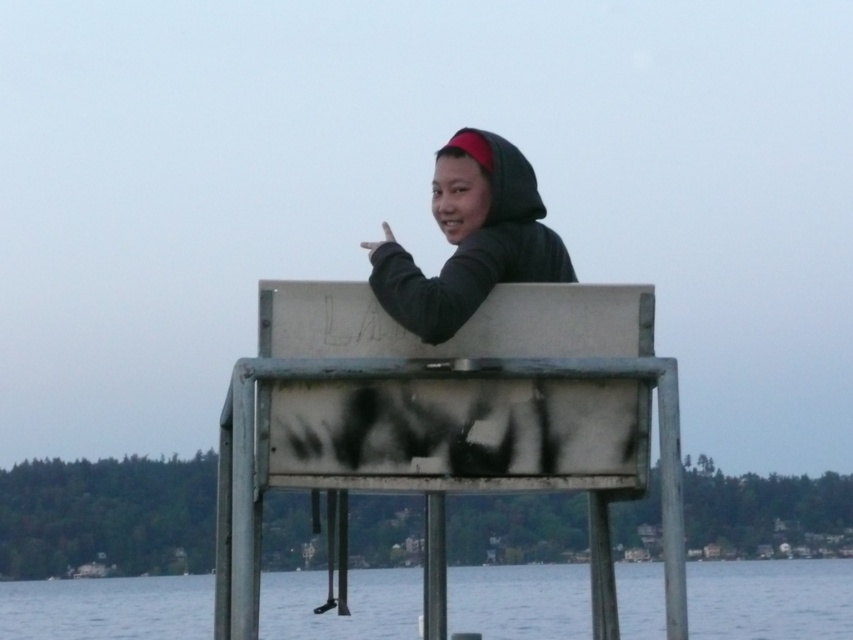
Question: Which object is the closest to the black matte hoodie at upper center?

Choices:
 (A) transparent water at lower center
 (B) metallic gray dock at center

Answer: (B)

Question: Among these objects, which one is farthest from the camera?

Choices:
 (A) black matte hoodie at upper center
 (B) transparent water at lower center

Answer: (A)

Question: Can you confirm if transparent water at lower center is positioned to the right of black matte hoodie at upper center?

Choices:
 (A) yes
 (B) no

Answer: (B)

Question: Which point is farther to the camera?

Choices:
 (A) metallic gray dock at center
 (B) transparent water at lower center
 (C) black matte hoodie at upper center

Answer: (A)

Question: Is transparent water at lower center further to the viewer compared to black matte hoodie at upper center?

Choices:
 (A) yes
 (B) no

Answer: (B)

Question: Can you confirm if metallic gray dock at center is smaller than black matte hoodie at upper center?

Choices:
 (A) yes
 (B) no

Answer: (A)